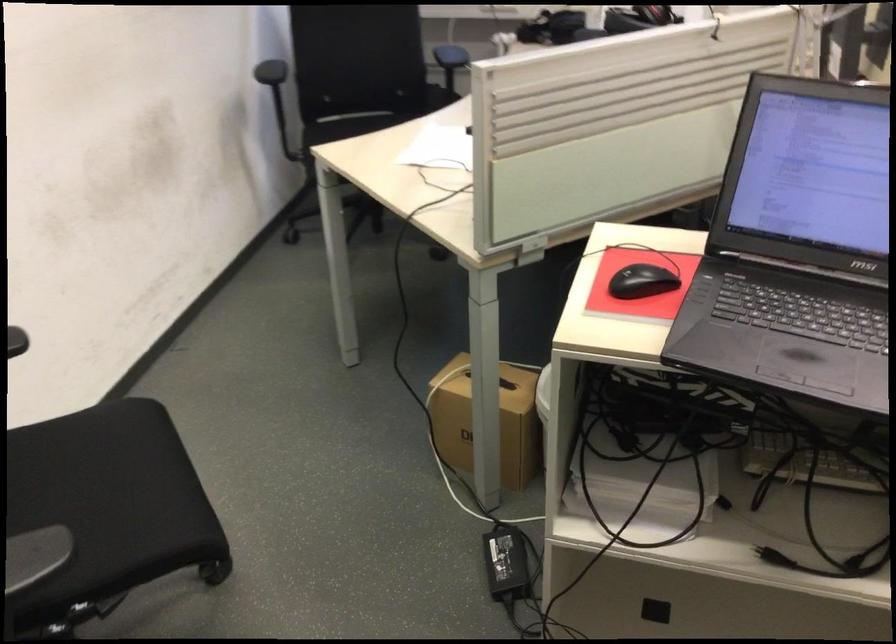
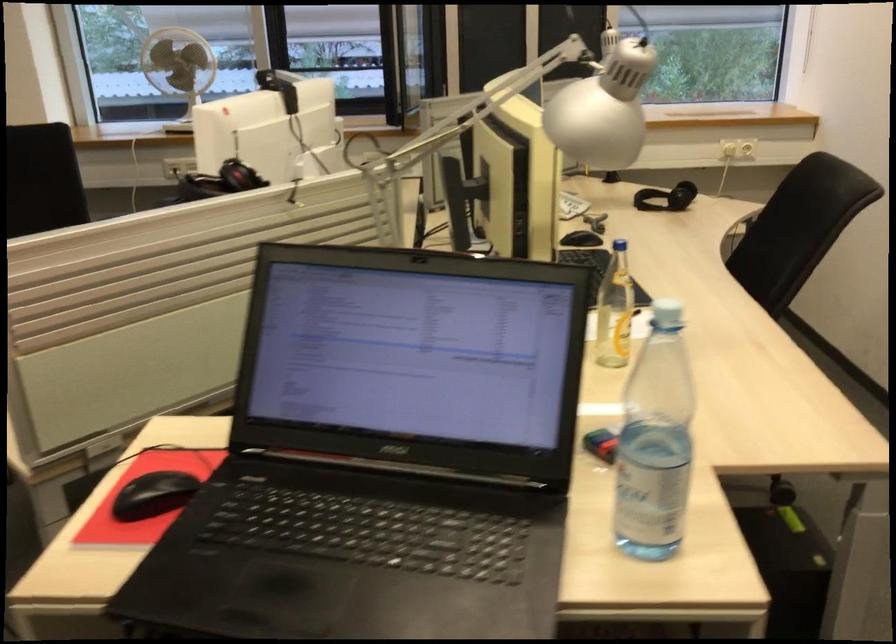
Locate, in the second image, the point that corresponds to the point at 648,277 in the first image.

(153, 495)